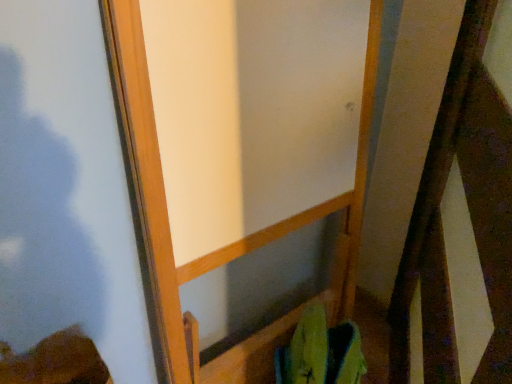
In order to click on green fabric laundry at lower center in this screenshot , I will do `click(320, 352)`.

What do you see at coordinates (320, 352) in the screenshot? I see `green fabric laundry at lower center` at bounding box center [320, 352].

Image resolution: width=512 pixels, height=384 pixels. Identify the location of green fabric laundry at lower center. (320, 352).